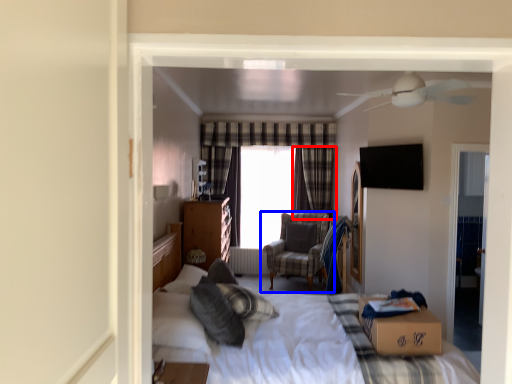
Question: Which object is further to the camera taking this photo, curtain (highlighted by a red box) or chair (highlighted by a blue box)?

Choices:
 (A) curtain
 (B) chair

Answer: (A)